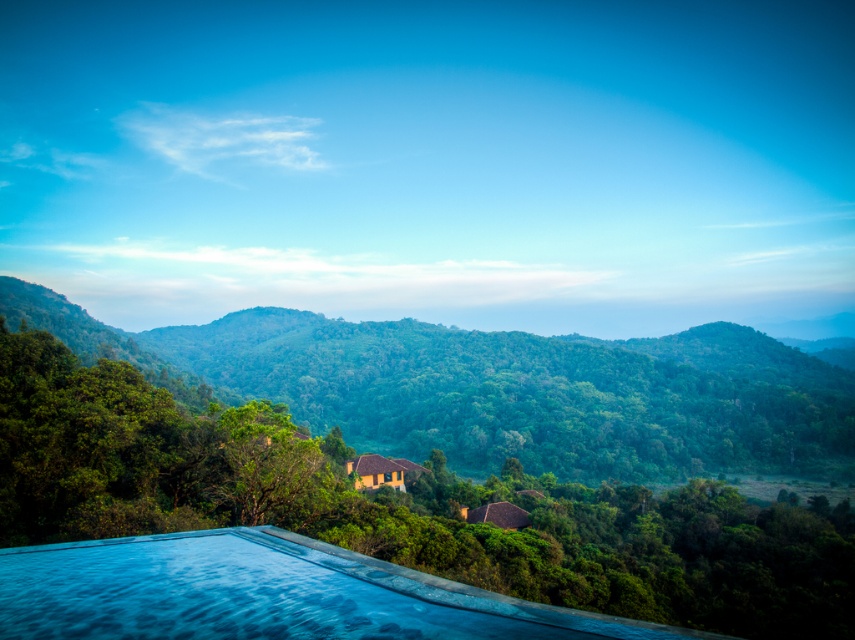
Does green leafy tree at center have a greater width compared to green leafy forest at center?

No.

Can you confirm if green leafy tree at center is positioned to the left of green leafy forest at center?

Incorrect, green leafy tree at center is not on the left side of green leafy forest at center.

Does point (115, 506) come behind point (705, 380)?

No, (115, 506) is closer to viewer.

The width and height of the screenshot is (855, 640). Find the location of `green leafy tree at center`. green leafy tree at center is located at coordinates (404, 506).